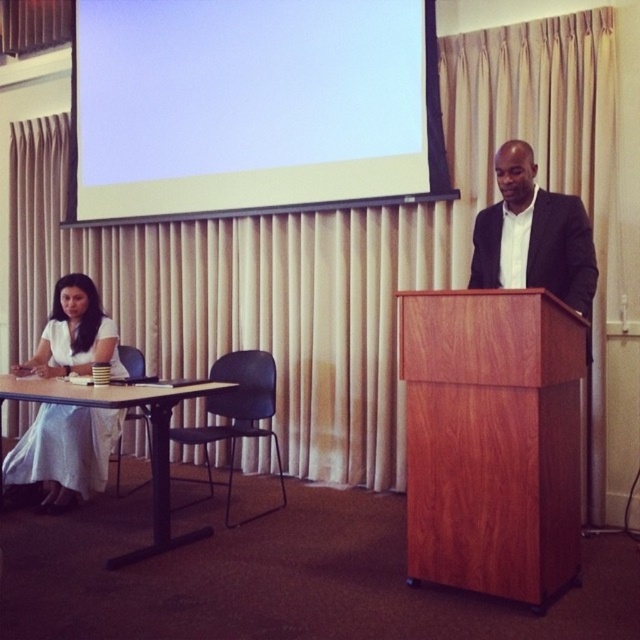
You are a photographer who needs to capture a closeup of the wooden table at lower left without moving any objects. The camera you are using has a maximum focus distance of 10 feet. Can you take the photo from your current position?

The wooden table at lower left and camera are 9.94 feet apart from each other, which is within the camera maximum focus distance of 10 feet. Yes, you can take the photo from your current position.